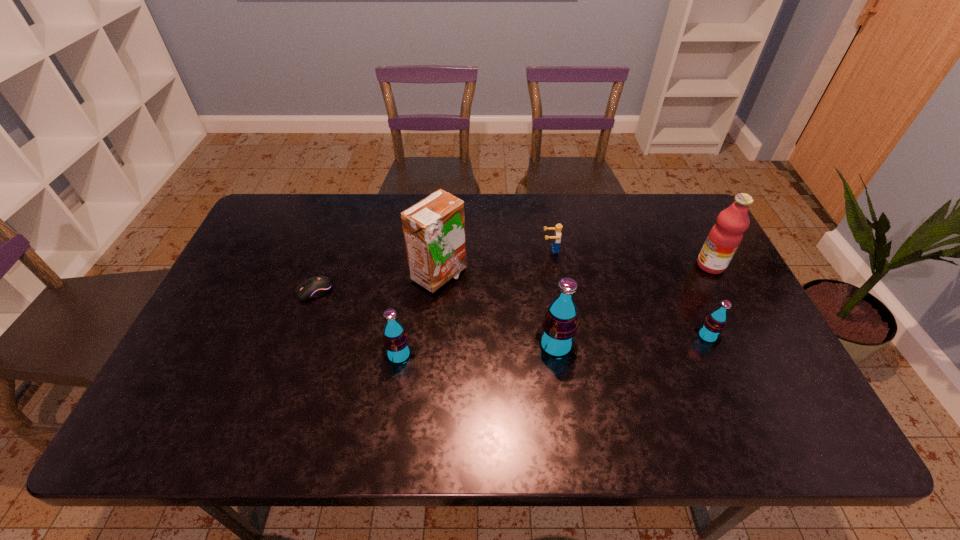
Identify the location of the fourth tallest object. (396, 347).

Where is `the leftmost soda`? This screenshot has height=540, width=960. the leftmost soda is located at coordinates (396, 347).

Locate an element on the screen. the second soda from left to right is located at coordinates (559, 326).

The width and height of the screenshot is (960, 540). Find the location of `the second object from right to left`. the second object from right to left is located at coordinates (709, 332).

Where is `the shortest soda`? the shortest soda is located at coordinates (709, 332).

You are a GUI agent. You are given a task and a screenshot of the screen. Output one action in this format:
    pyautogui.click(x=<x>, y=<y>)
    Task: Click on the rightmost object
    This screenshot has height=540, width=960.
    Given the screenshot: What is the action you would take?
    pyautogui.click(x=725, y=236)

Locate an element on the screen. the shortest object is located at coordinates coord(317,286).

You are a GUI agent. You are given a task and a screenshot of the screen. Output one action in this format:
    pyautogui.click(x=<x>, y=<y>)
    Task: Click on the leftmost object
    
    Given the screenshot: What is the action you would take?
    pyautogui.click(x=317, y=286)

At what (x,y) coordinates should I click in order to perform the action: click on the second shortest object. Please return your answer as a coordinate pair (x, y). The width and height of the screenshot is (960, 540). Looking at the image, I should click on (x=556, y=238).

Where is `Lego`? The image size is (960, 540). Lego is located at coordinates (556, 238).